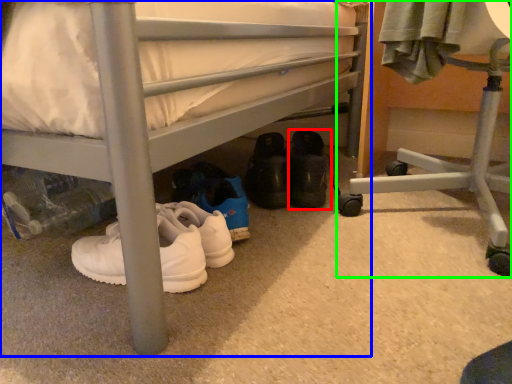
Question: Estimate the real-world distances between objects in this image. Which object is closer to footwear (highlighted by a red box), bed (highlighted by a blue box) or furniture (highlighted by a green box)?

Choices:
 (A) bed
 (B) furniture

Answer: (B)